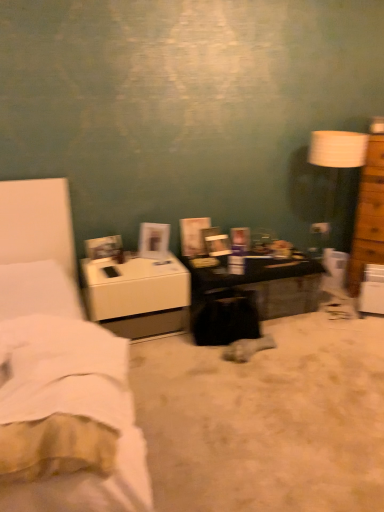
Where is `free space above white glossy nightstand at left (from a real-world perspective)`? The width and height of the screenshot is (384, 512). free space above white glossy nightstand at left (from a real-world perspective) is located at coordinates (133, 265).